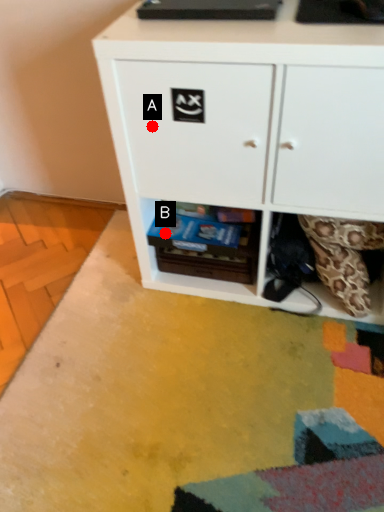
Question: Two points are circled on the image, labeled by A and B beside each circle. Which point appears farthest from the camera in this image?

Choices:
 (A) A is further
 (B) B is further

Answer: (B)